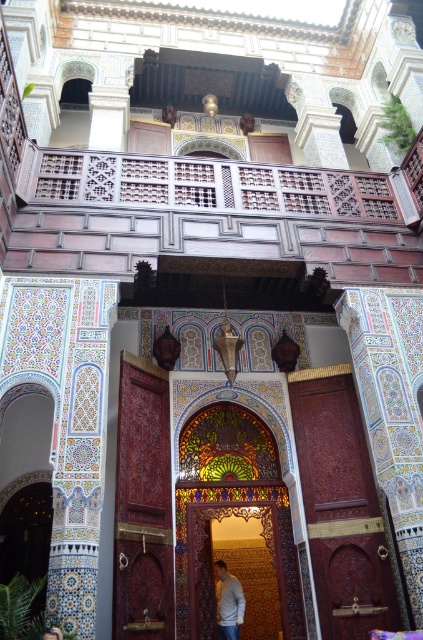
You are standing in the Moroccan riad courtyard and want to hang a decorative tapestry that is the same width as the light gray sweater at center. Can you fit it on the carved wood door at center without overlapping the edges?

The carved wood door at center is wider than the light gray sweater at center, so the tapestry can be hung on the door without overlapping the edges since the door is wider.

You are standing in the Moroccan riad courtyard and want to place a small potted plant between the two points marked as point [213,563] and point [60,634]. Which point should the plant be closer to in order to be closer to the viewer?

The plant should be placed closer to point [213,563] because it is closer to the viewer compared to point [60,634].

You are a fashion designer observing the image of the Moroccan courtyard. You notice a person wearing a light gray sweater at center and another with light brown hair at center. Which clothing item has a greater width in the scene?

The light gray sweater at center has a greater width than the light brown hair at center.